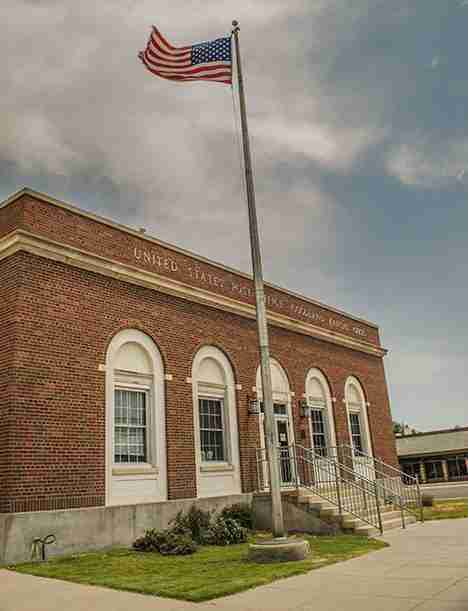
The image size is (468, 611). Find the location of `handrail`. handrail is located at coordinates (362, 478), (396, 470).